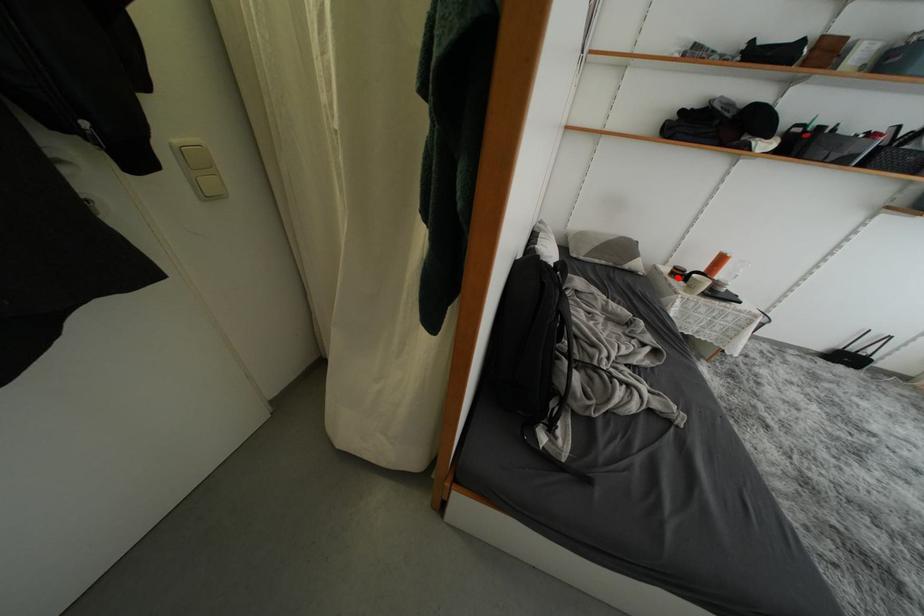
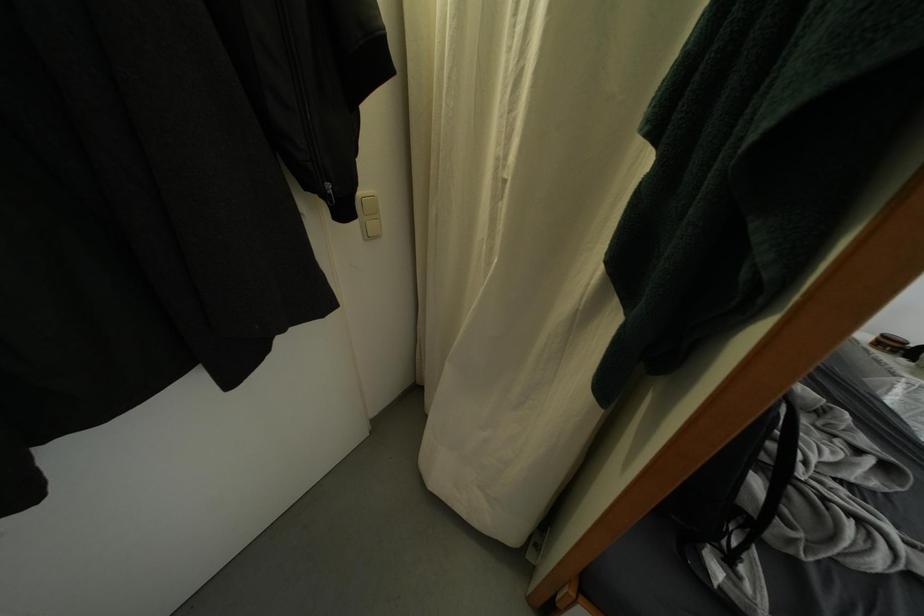
Question: A red point is marked in image1. In image2, is the corresponding 3D point closer to the camera or farther? Reply with the corresponding letter.

Choices:
 (A) The corresponding 3D point is closer.
 (B) The corresponding 3D point is farther.

Answer: (B)